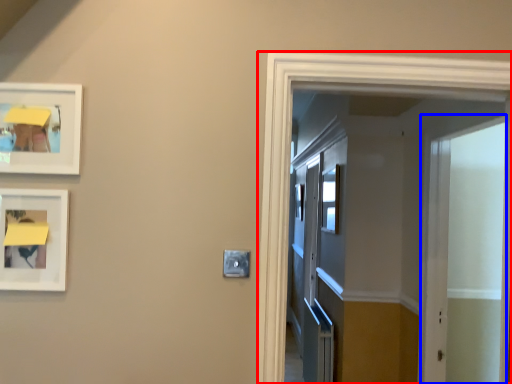
Question: Which point is closer to the camera, elevator (highlighted by a red box) or screen door (highlighted by a blue box)?

Choices:
 (A) elevator
 (B) screen door

Answer: (A)